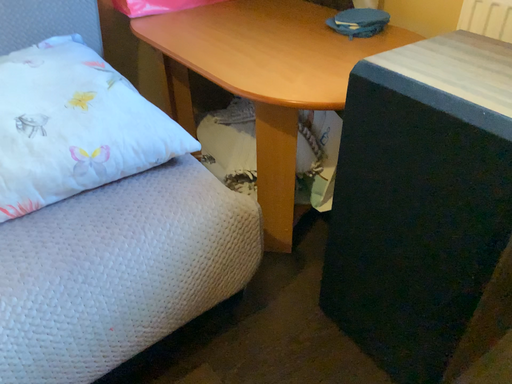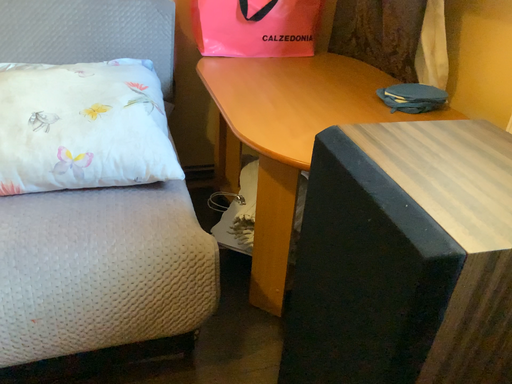
Question: Which way did the camera rotate in the video?

Choices:
 (A) rotated upward
 (B) rotated downward

Answer: (A)